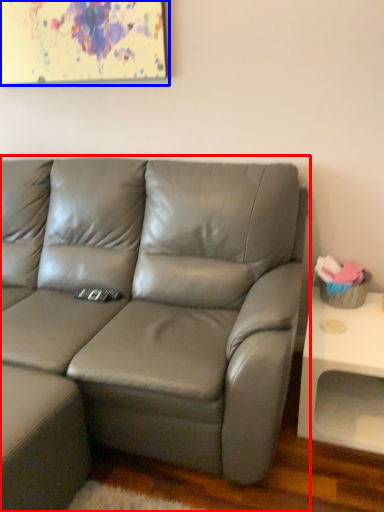
Question: Among these objects, which one is farthest to the camera, studio couch (highlighted by a red box) or picture frame (highlighted by a blue box)?

Choices:
 (A) studio couch
 (B) picture frame

Answer: (B)